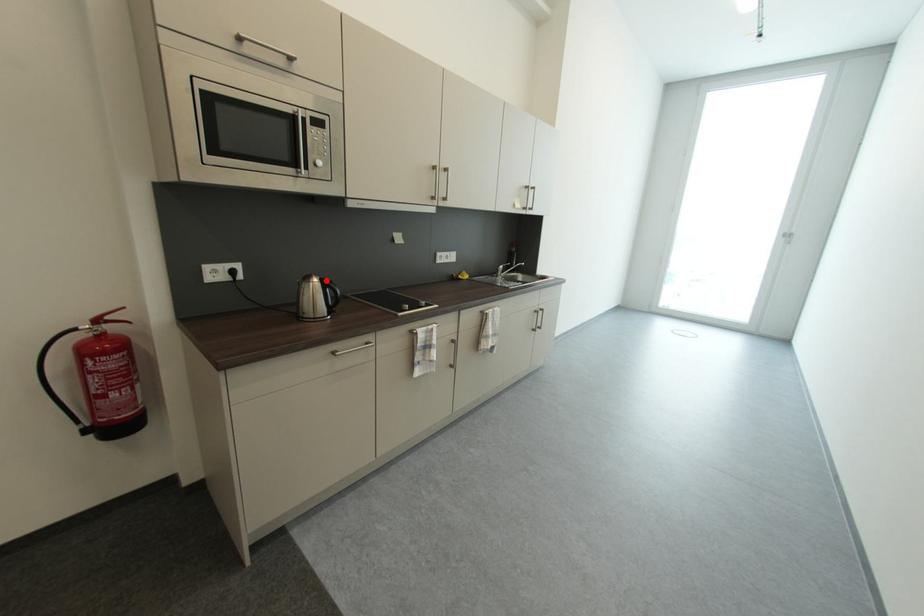
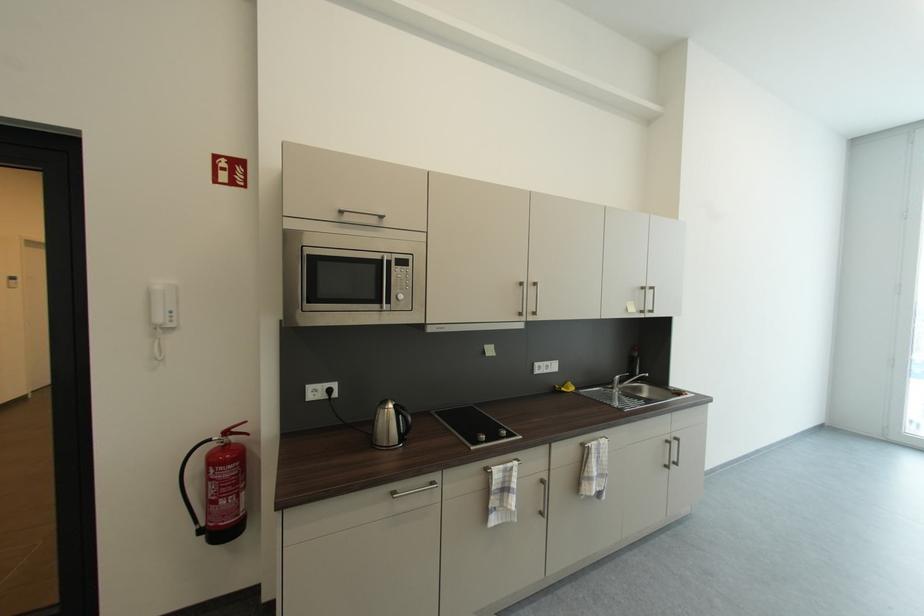
Where in the second image is the point corresponding to the highlighted location from the first image?

(400, 407)